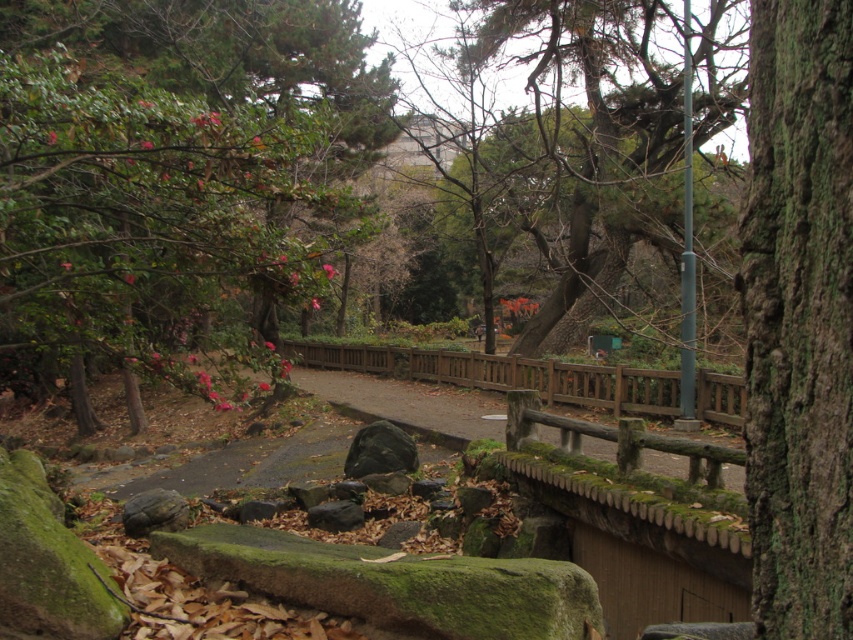
You are a park visitor standing at the entrance of the pathway. You see the green leafy tree at upper left and the green mossy bark at right. Which object is positioned more to the left side of the scene?

The green leafy tree at upper left is positioned more to the left side of the scene compared to the green mossy bark at right.

You are standing at the point with coordinates point (820, 428) and want to walk towards the point with coordinates point (550, 225). Which direction should you face to move directly towards it?

You should face towards the direction opposite of point (820, 428) since point (550, 225) is behind it.